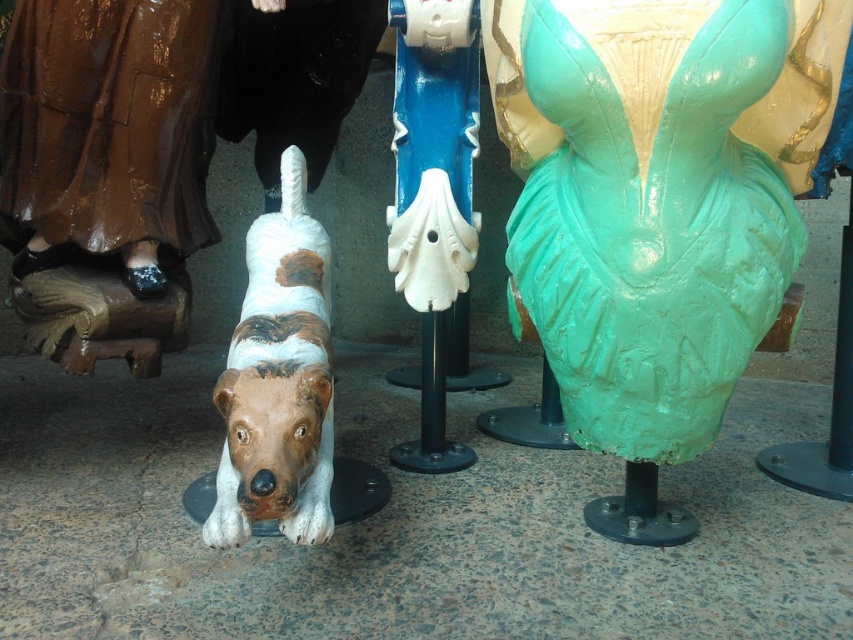
Question: In this image, where is speckled ceramic dog at lower left located relative to white glossy pole at center?

Choices:
 (A) right
 (B) left

Answer: (B)

Question: Does speckled ceramic dog at lower left appear over white glossy pole at center?

Choices:
 (A) no
 (B) yes

Answer: (A)

Question: Among these objects, which one is nearest to the camera?

Choices:
 (A) white glossy pole at center
 (B) speckled ceramic dog at lower left

Answer: (B)

Question: Can you confirm if speckled ceramic dog at lower left is positioned to the right of white glossy pole at center?

Choices:
 (A) no
 (B) yes

Answer: (A)

Question: Which point is closer to the camera taking this photo?

Choices:
 (A) (233, 490)
 (B) (474, 216)

Answer: (A)